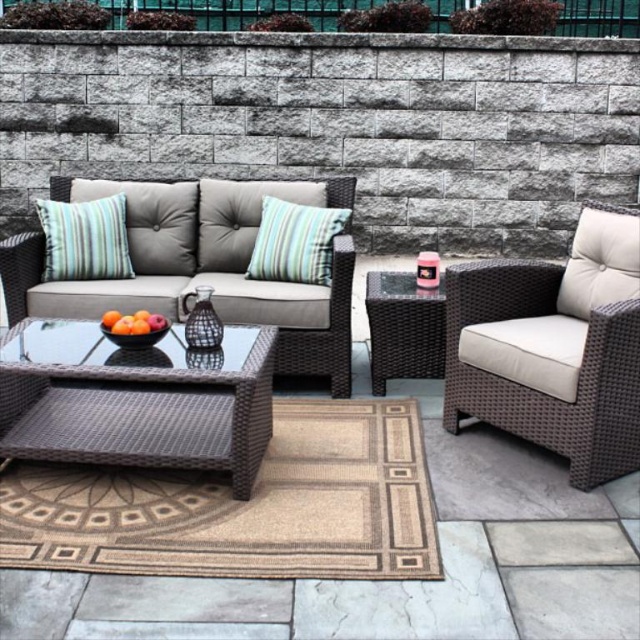
Does glossy wicker table at center appear on the left side of woven rattan couch at center?

Correct, you'll find glossy wicker table at center to the left of woven rattan couch at center.

Does glossy wicker table at center come in front of woven rattan couch at center?

Yes, glossy wicker table at center is in front of woven rattan couch at center.

Who is more forward, (125, 362) or (19, 252)?

Point (125, 362) is more forward.

The image size is (640, 640). Identify the location of glossy wicker table at center. (136, 400).

Between point (625, 241) and point (116, 262), which one is positioned behind?

Positioned behind is point (116, 262).

Does point (452, 358) come in front of point (90, 244)?

Yes.

The image size is (640, 640). I want to click on brown woven armchair at right, so click(x=554, y=348).

Locate an element on the screen. This screenshot has width=640, height=640. brown woven armchair at right is located at coordinates (554, 348).

Which is in front, point (600, 212) or point (163, 189)?

Point (600, 212) is more forward.

The width and height of the screenshot is (640, 640). In order to click on brown woven armchair at right in this screenshot , I will do (x=554, y=348).